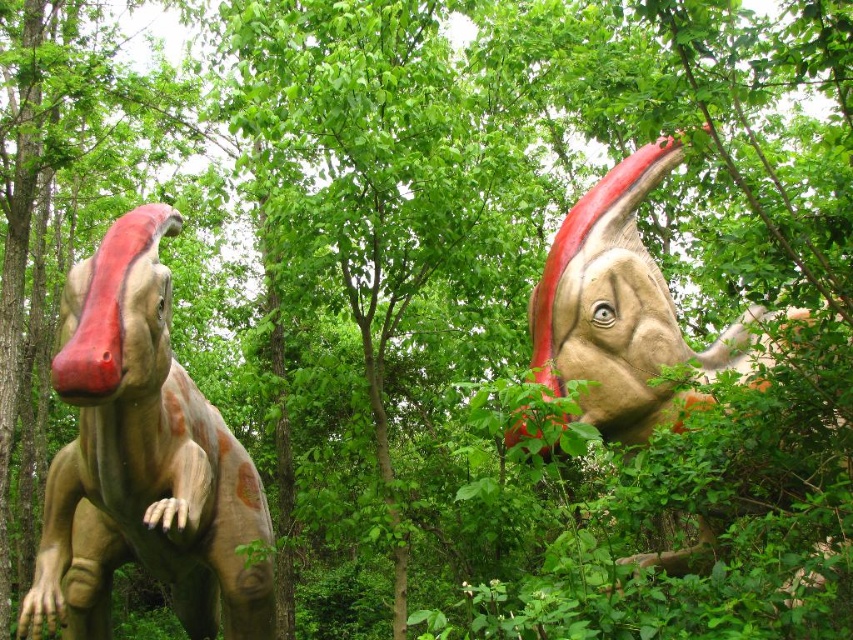
You are a tour guide leading a group through the dinosaur exhibit. You need to ensure that visitors can comfortably walk between the two statues without feeling cramped. The path between the matte brown dinosaur at left and the matte orange dinosaur at upper right must allow for a minimum of 10 feet of space. Based on the scene description, is the current spacing sufficient?

The matte brown dinosaur at left is 15.88 feet from the matte orange dinosaur at upper right, which exceeds the required 10 feet of space. Therefore, the current spacing is sufficient for visitors to comfortably walk between them without feeling cramped.

You are a park visitor who wants to take a photo of both the matte brown dinosaur at left and the matte orange dinosaur at upper right. Since you have a camera with a limited zoom, you need to know which dinosaur is wider to ensure it fits in the frame. Which dinosaur has a greater width?

The matte orange dinosaur at upper right has a greater width than the matte brown dinosaur at left.